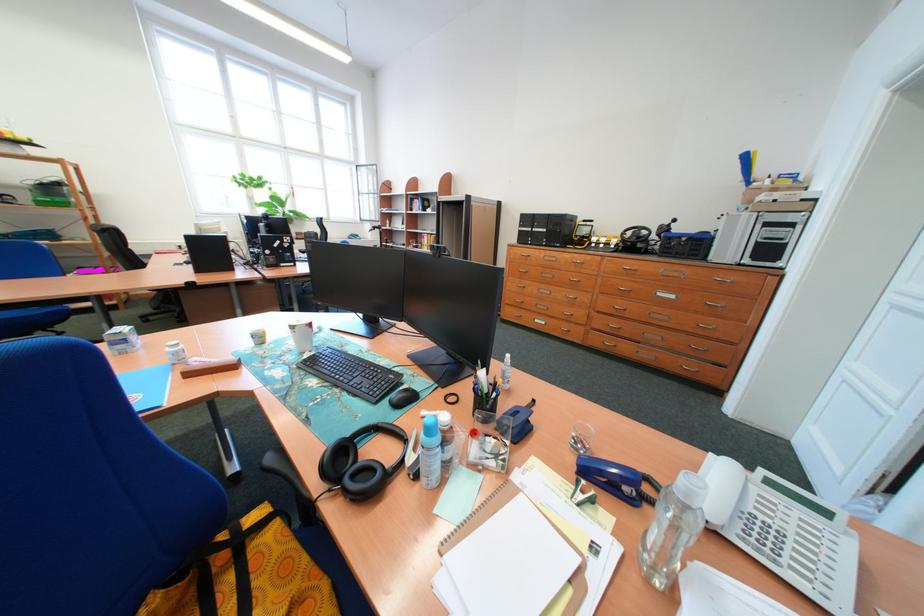
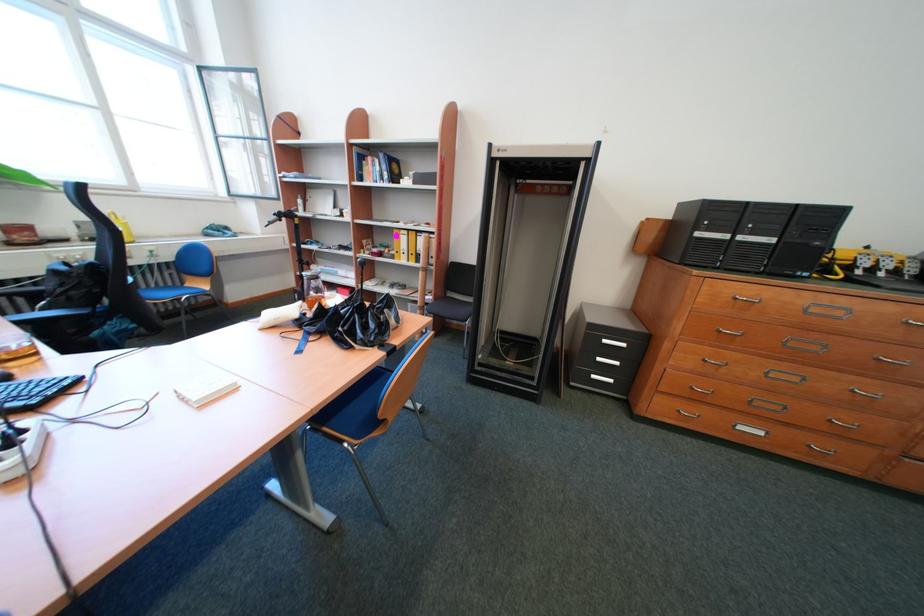
Which direction would the cameraman need to move to produce the second image?

The movement direction of the cameraman is left, forward.